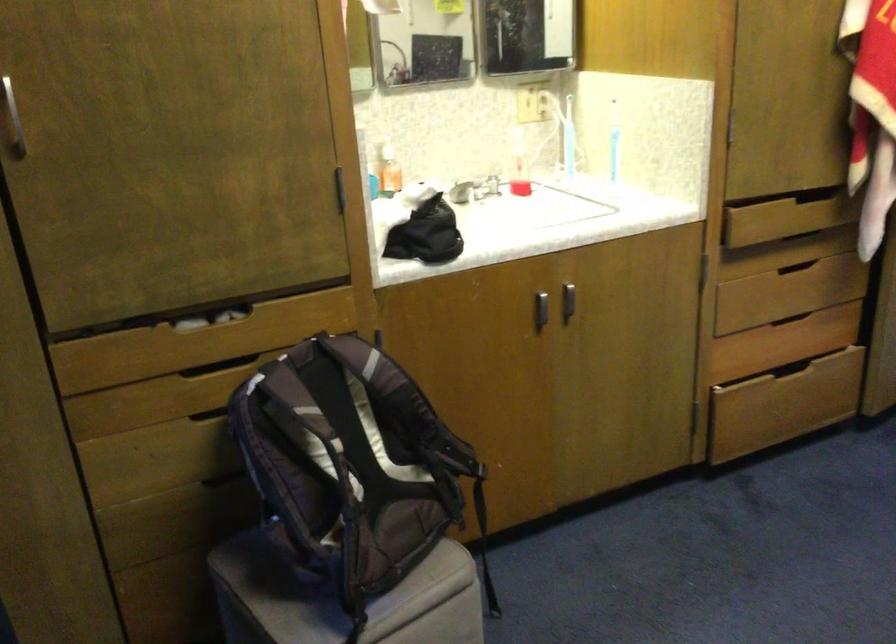
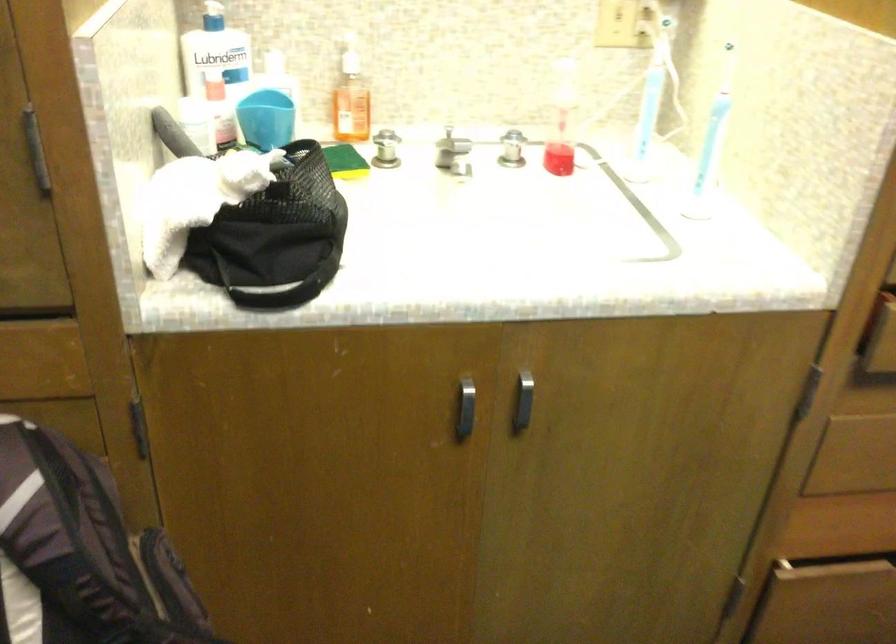
Find the pixel in the second image that matches point 366,184 in the first image.

(265, 118)